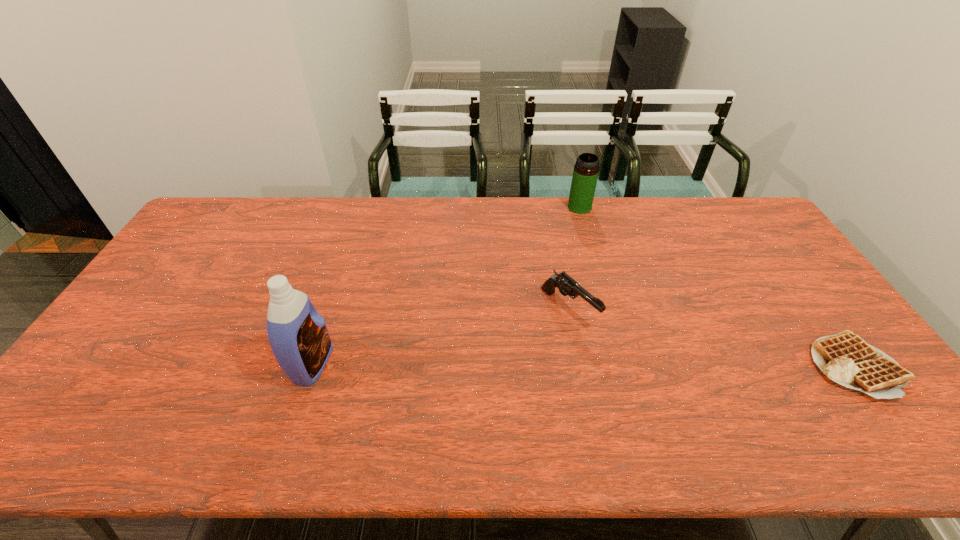
This screenshot has width=960, height=540. I want to click on the leftmost object, so click(298, 335).

Where is `detergent`? detergent is located at coordinates (298, 335).

Identify the location of waffle. The width and height of the screenshot is (960, 540). pos(845,358).

This screenshot has height=540, width=960. In order to click on the shortest object in this screenshot , I will do click(845, 358).

You are a GUI agent. You are given a task and a screenshot of the screen. Output one action in this format:
    pyautogui.click(x=<x>, y=<y>)
    Task: Click on the third tallest object
    The width and height of the screenshot is (960, 540).
    Given the screenshot: What is the action you would take?
    pyautogui.click(x=568, y=286)

Image resolution: width=960 pixels, height=540 pixels. In order to click on the third shortest object in this screenshot , I will do `click(585, 174)`.

Image resolution: width=960 pixels, height=540 pixels. What are the coordinates of `thermos bottle` in the screenshot? It's located at (585, 174).

The image size is (960, 540). In order to click on vacant point located on the right of the leftmost object in this screenshot , I will do pyautogui.click(x=365, y=364).

Where is `vacant space situated on the back of the shortest object`? Image resolution: width=960 pixels, height=540 pixels. vacant space situated on the back of the shortest object is located at coordinates [x=763, y=240].

Locate an element on the screen. free space located 0.270m at the end of the barrel of the gun is located at coordinates (670, 400).